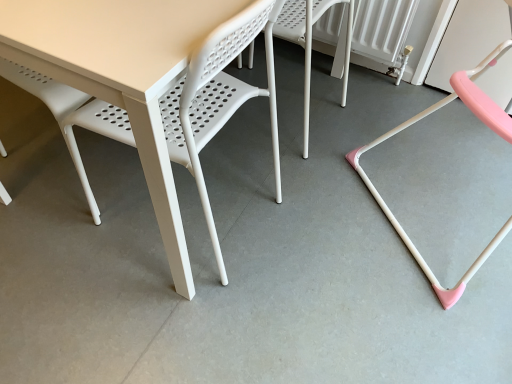
The width and height of the screenshot is (512, 384). I want to click on vacant area that is situated to the right of white plastic table at center, so coord(319,233).